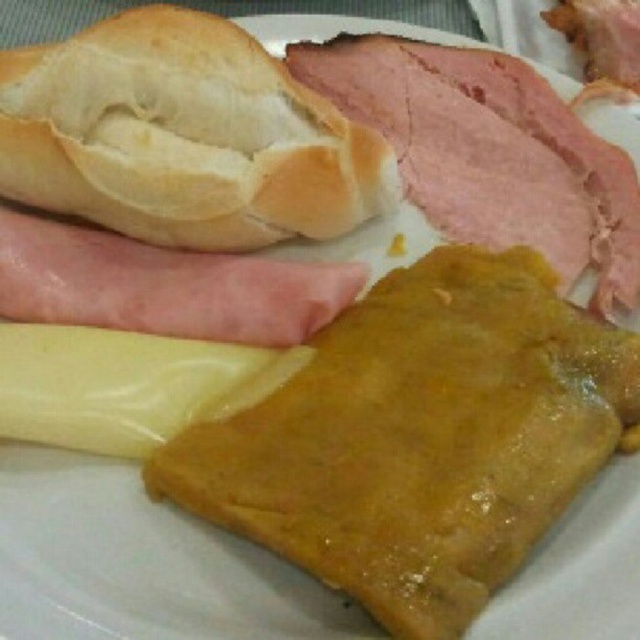
You are looking at the plate of food from above. There are two points marked on the plate, one at coordinates point [557,189] and the other at point [275,301]. Which point is closer to you?

Point [557,189] is further to the camera than point [275,301], so the point closer to you is point [275,301].